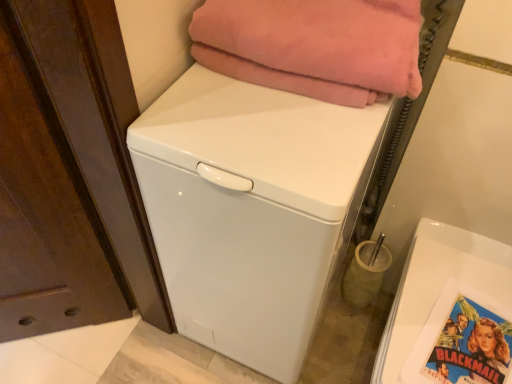
The image size is (512, 384). Identify the location of vacant region under blue glossy comic book at lower right (from a real-world perspective). (476, 351).